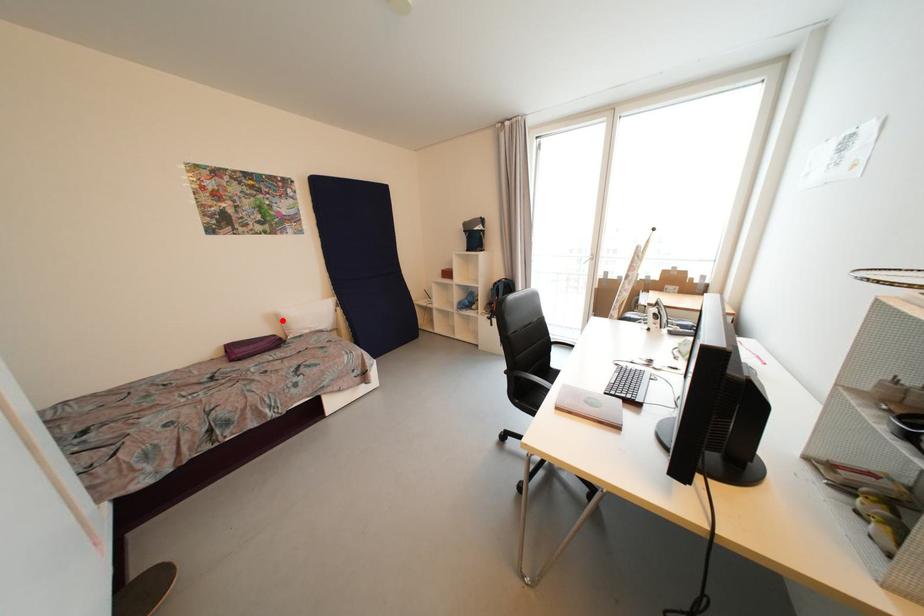
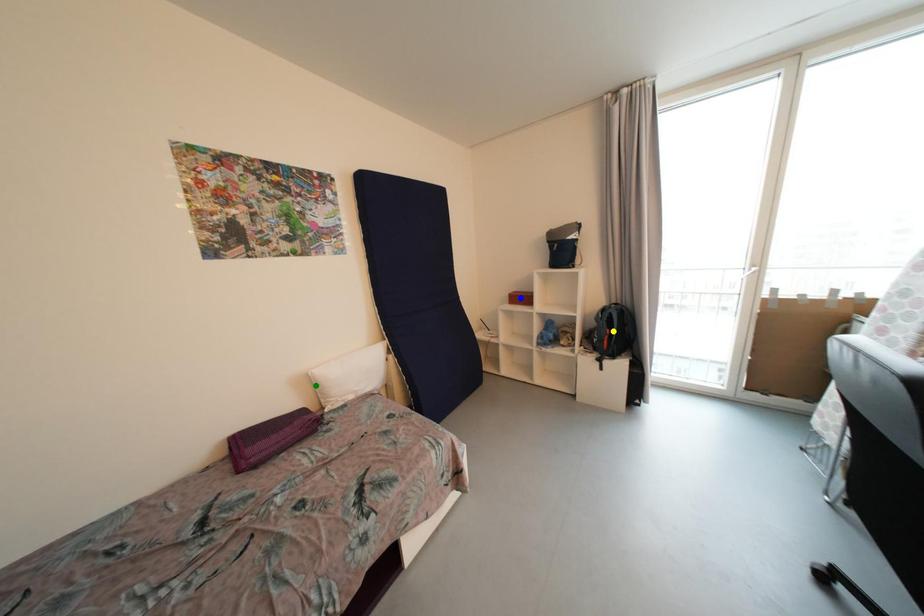
Question: I am providing you with two images of the same scene from different viewpoints. A red point is marked on the first image. You are given multiple points on the second image. In image 2, which mark is for the same physical point as the one in image 1?

Choices:
 (A) yellow point
 (B) green point
 (C) blue point

Answer: (B)